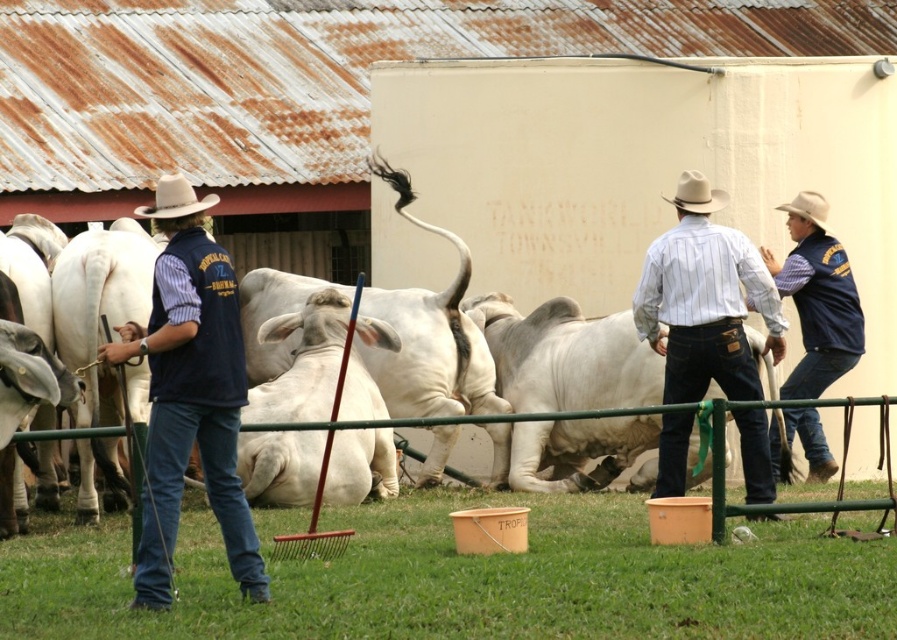
Looking at this image, you are a photographer trying to capture a photo of the white smooth bull at center and the white matte cowboy hat at upper right. From your current position, which object would you need to pan your camera to the right to include in the frame?

To include the white matte cowboy hat at upper right in the frame, you would need to pan your camera to the right since the white smooth bull at center is positioned to the left of it.

You are a photographer at the cattle show and want to ensure both the white felt cowboy hat at center and the white matte cowboy hat at upper right are visible in your photo. Which hat will appear larger in the photo?

The white felt cowboy hat at center will appear larger in the photo because it has a larger size compared to the white matte cowboy hat at upper right.

You are a photographer standing at the edge of the grassy area. You want to take a photo of the white smooth bull at center without the white matte cowboy hat at upper right appearing in the frame. Is this possible based on their positions?

The white smooth bull at center is in front of the white matte cowboy hat at upper right, so if you position yourself so the bull blocks the view of the hat, you can take the photo without the hat appearing in the frame.